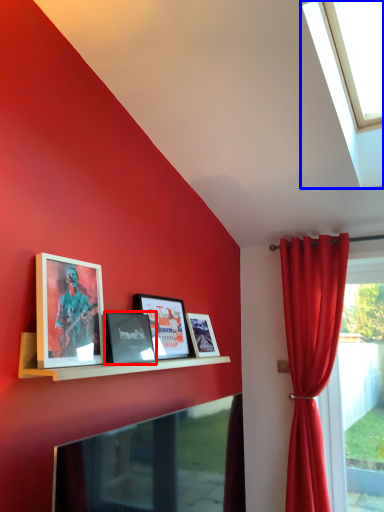
Question: Which of the following is the farthest to the observer, picture frame (highlighted by a red box) or window (highlighted by a blue box)?

Choices:
 (A) picture frame
 (B) window

Answer: (A)